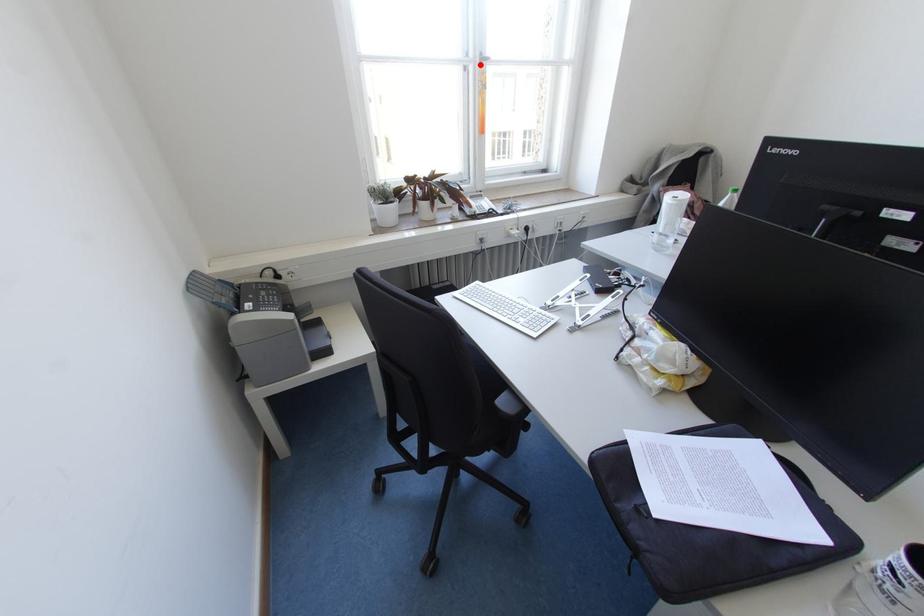
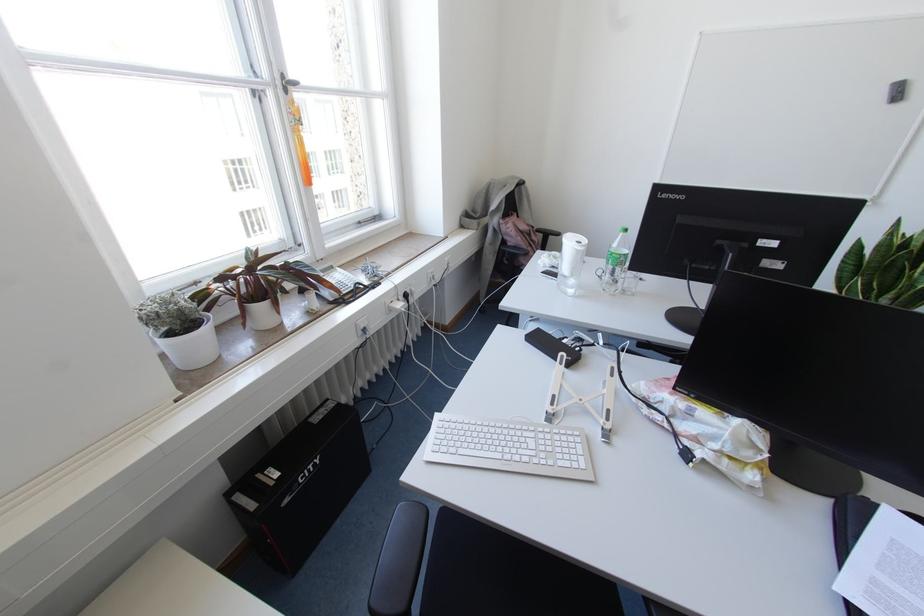
Locate, in the second image, the point that corresponds to the highlighted location in the first image.

(285, 90)